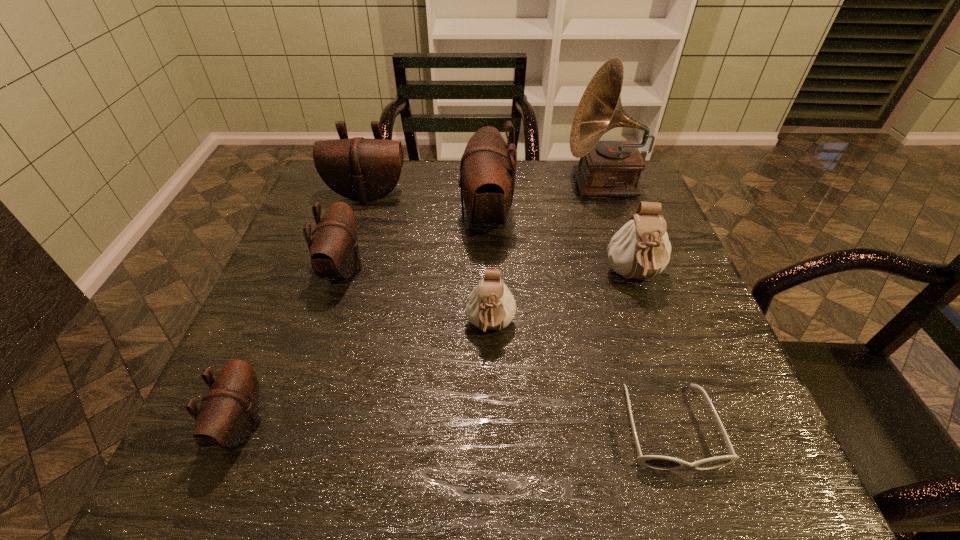
Image resolution: width=960 pixels, height=540 pixels. I want to click on free space that is in between the smallest brown pouch and the tallest pouch, so click(364, 320).

Image resolution: width=960 pixels, height=540 pixels. I want to click on free space between the right white pouch and the sunglasses, so click(x=652, y=352).

At what (x,y) coordinates should I click in order to perform the action: click on vacant area that lies between the black sunglasses and the third smallest brown pouch. Please return your answer as a coordinate pair (x, y). Looking at the image, I should click on (518, 311).

The height and width of the screenshot is (540, 960). Find the location of `vacant area that lies between the sunglasses and the seventh shortest object`. vacant area that lies between the sunglasses and the seventh shortest object is located at coordinates (578, 322).

Identify the location of free space that is in between the left white pouch and the second biggest brown pouch. Image resolution: width=960 pixels, height=540 pixels. (429, 261).

Where is `vacant region between the biggest brown pouch and the tallest object`? This screenshot has width=960, height=540. vacant region between the biggest brown pouch and the tallest object is located at coordinates (545, 200).

Locate which object is the closest to the second nearest pouch. Please provide its 2D coordinates. Your answer should be formatted as a tuple, i.e. [(x, y)], where the tuple contains the x and y coordinates of a point satisfying the conditions above.

[(487, 177)]

Point out which object is positioned as the fourth nearest to the phonograph record. Please provide its 2D coordinates. Your answer should be formatted as a tuple, i.e. [(x, y)], where the tuple contains the x and y coordinates of a point satisfying the conditions above.

[(361, 169)]

Image resolution: width=960 pixels, height=540 pixels. I want to click on pouch that stands as the second closest to the second biggest brown pouch, so [x=487, y=177].

Locate an element on the screen. This screenshot has width=960, height=540. the third closest pouch to the third smallest brown pouch is located at coordinates (490, 306).